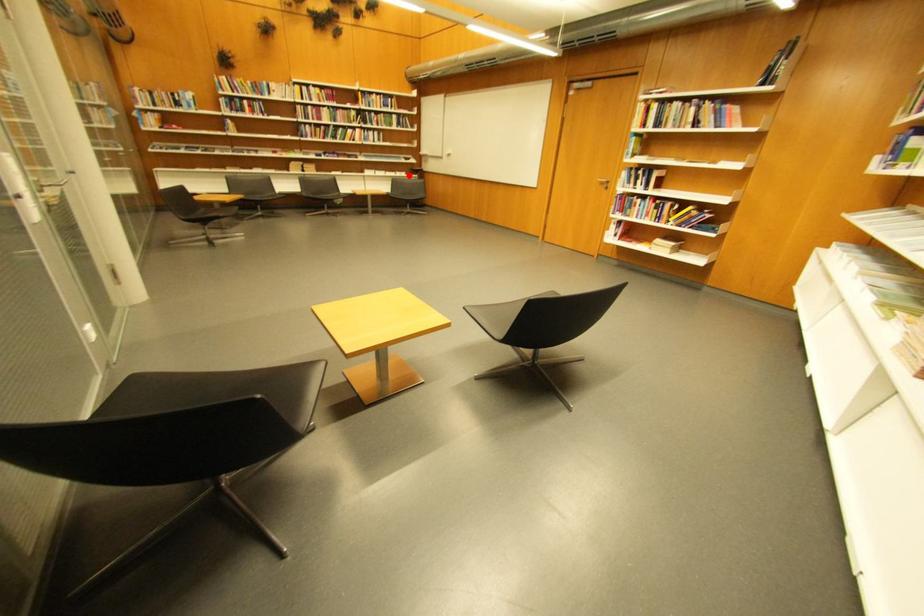
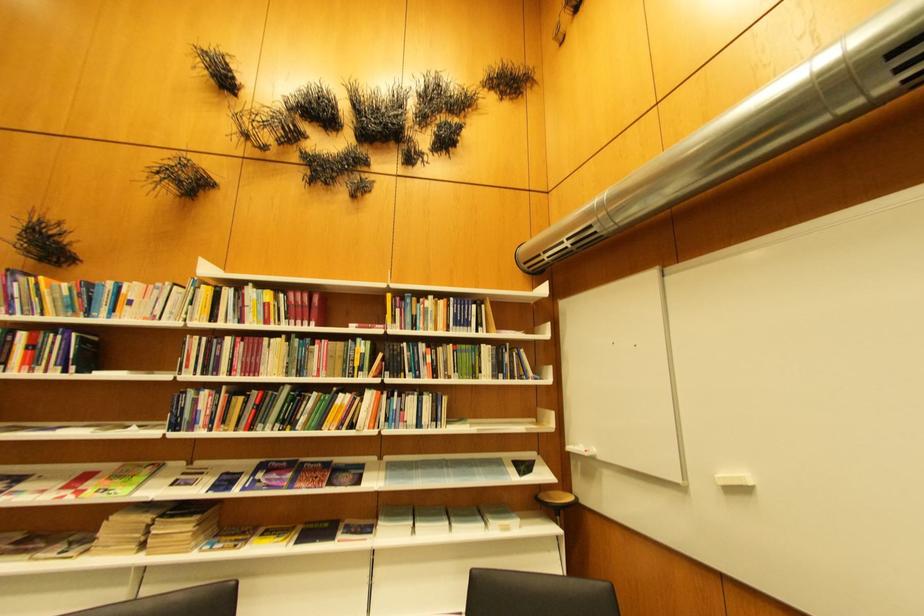
Question: A red point is marked in image1. In image2, is the corresponding 3D point closer to the camera or farther? Reply with the corresponding letter.

Choices:
 (A) The corresponding 3D point is closer.
 (B) The corresponding 3D point is farther.

Answer: (B)